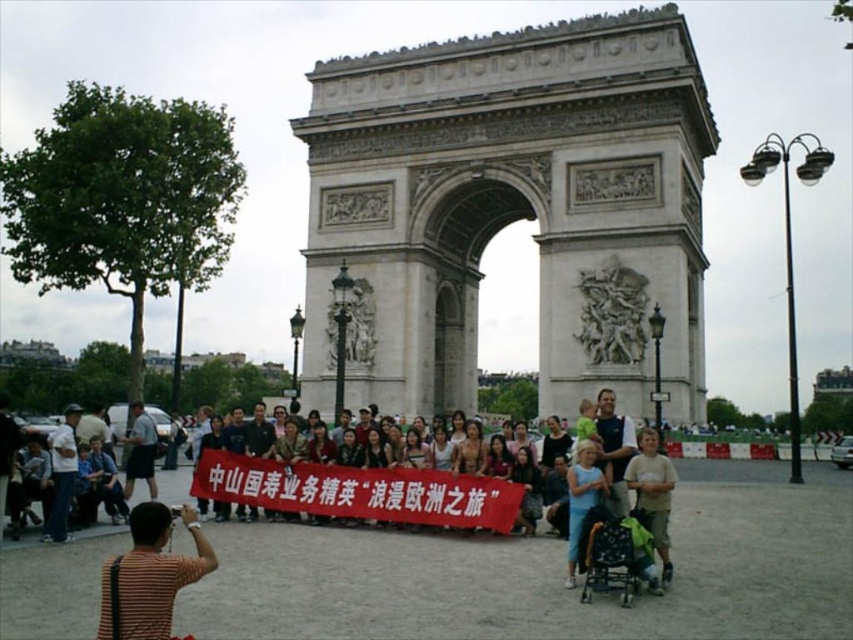
Is point (360, 472) farther from viewer compared to point (607, 566)?

Yes, it is behind point (607, 566).

Does matte brown banner at center appear over dark blue fabric baby carriage at lower center?

Yes.

Locate an element on the screen. matte brown banner at center is located at coordinates (360, 492).

The height and width of the screenshot is (640, 853). In order to click on matte brown banner at center in this screenshot , I will do `click(360, 492)`.

Between matte brown banner at center and light brown fabric shirt at lower right, which one has more height?

light brown fabric shirt at lower right

The image size is (853, 640). In order to click on matte brown banner at center in this screenshot , I will do `click(360, 492)`.

Does dark blue fabric baby carriage at lower center appear under light brown fabric shirt at lower right?

Correct, dark blue fabric baby carriage at lower center is located below light brown fabric shirt at lower right.

Who is more forward, (598, 563) or (654, 540)?

Point (598, 563)

You are a GUI agent. You are given a task and a screenshot of the screen. Output one action in this format:
    pyautogui.click(x=<x>, y=<y>)
    Task: Click on the dark blue fabric baby carriage at lower center
    
    Given the screenshot: What is the action you would take?
    pyautogui.click(x=614, y=556)